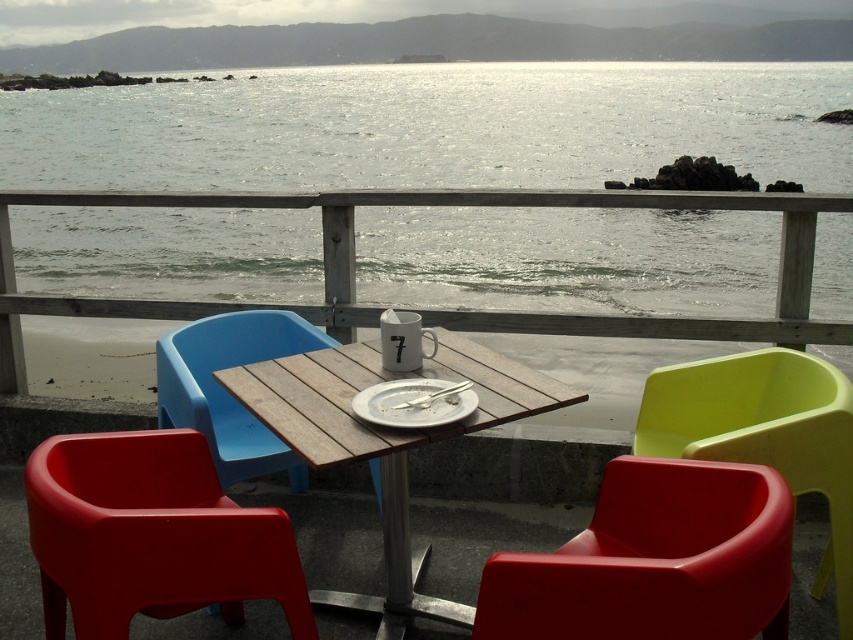
You are standing on the balcony and want to sit down at the wooden table at center. Which direction should you move relative to the matte plastic chair at lower left?

You should move towards the wooden table at center, which is behind the matte plastic chair at lower left since the chair is closer to you than the table.

You are standing at the point marked by coordinates point (90, 310) on the balcony overlooking the ocean. You want to toss a small pebble into the water below. If you can throw the pebble 4 meters horizontally, will it reach the water?

The distance between you and the viewer is 3.79 meters, which is less than your throwing range of 4 meters. Therefore, the pebble will reach the water.